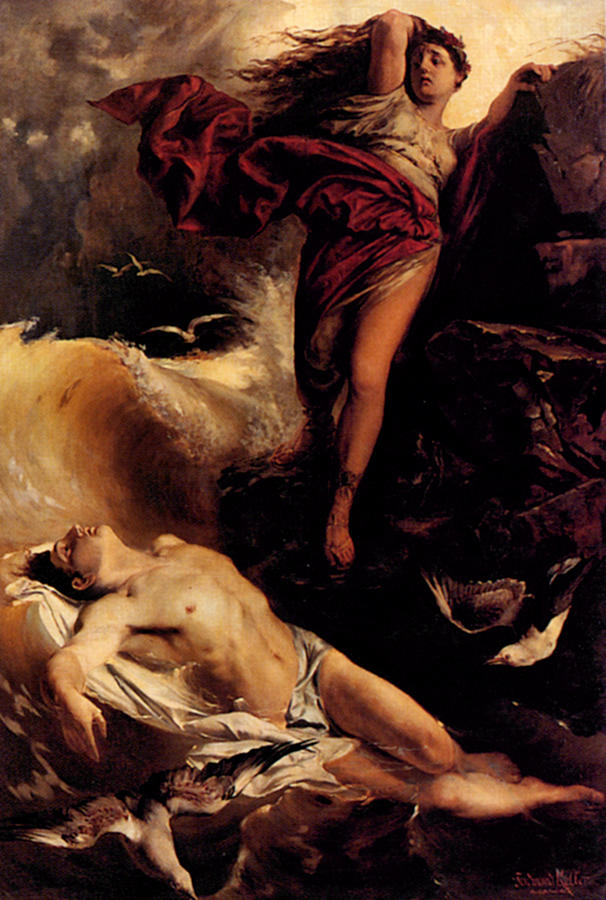
Locate an element on the screen. sheets is located at coordinates (304, 708).